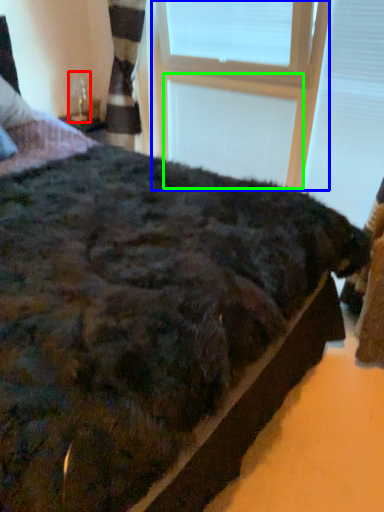
Question: Estimate the real-world distances between objects in this image. Which object is farther from table lamp (highlighted by a red box), window frame (highlighted by a blue box) or window frame (highlighted by a green box)?

Choices:
 (A) window frame
 (B) window frame

Answer: (B)